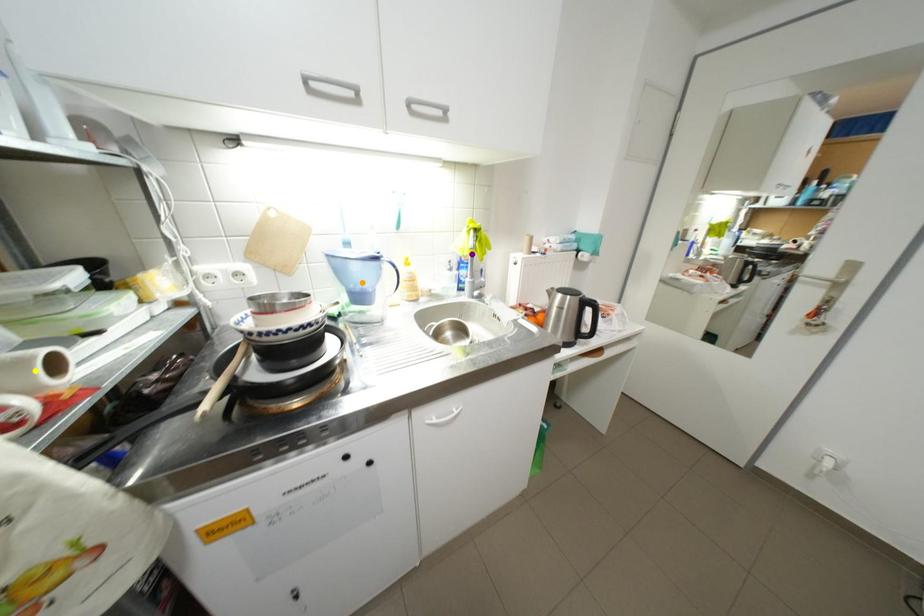
Order these from nearest to farthest:
yellow point
orange point
purple point

yellow point → orange point → purple point